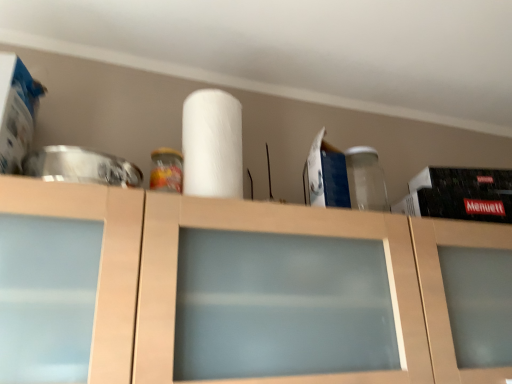
Question: From the image's perspective, is matte wood cabinet at center positioned above or below white matte paper towel at center?

Choices:
 (A) above
 (B) below

Answer: (B)

Question: In the image, is matte wood cabinet at center positioned in front of or behind white matte paper towel at center?

Choices:
 (A) behind
 (B) front

Answer: (B)

Question: From a real-world perspective, is matte wood cabinet at center positioned above or below white matte paper towel at center?

Choices:
 (A) below
 (B) above

Answer: (A)

Question: Is point (203, 99) positioned closer to the camera than point (144, 327)?

Choices:
 (A) farther
 (B) closer

Answer: (A)

Question: From a real-world perspective, is white matte paper towel at center positioned above or below matte wood cabinet at center?

Choices:
 (A) below
 (B) above

Answer: (B)

Question: Visually, is white matte paper towel at center positioned to the left or to the right of matte wood cabinet at center?

Choices:
 (A) right
 (B) left

Answer: (B)

Question: Would you say white matte paper towel at center is inside or outside matte wood cabinet at center?

Choices:
 (A) inside
 (B) outside

Answer: (B)